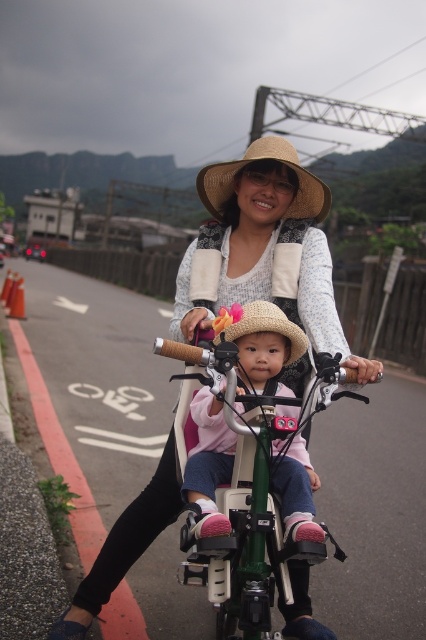
Question: Which object appears closest to the camera in this image?

Choices:
 (A) strawmaterial/texturehat at upper center
 (B) matte straw hat at center

Answer: (B)

Question: Can you confirm if matte straw hat at center is positioned to the left of pink fleece jacket at center?

Choices:
 (A) no
 (B) yes

Answer: (A)

Question: Estimate the real-world distances between objects in this image. Which object is closer to the strawmaterial/texturehat at upper center?

Choices:
 (A) matte straw hat at center
 (B) green matte bicycle at center

Answer: (A)

Question: Can you confirm if green matte bicycle at center is positioned to the left of strawmaterial/texturehat at upper center?

Choices:
 (A) no
 (B) yes

Answer: (B)

Question: Among these points, which one is nearest to the camera?

Choices:
 (A) (48, 636)
 (B) (222, 163)

Answer: (A)

Question: Is green matte bicycle at center positioned in front of pink fleece jacket at center?

Choices:
 (A) no
 (B) yes

Answer: (B)